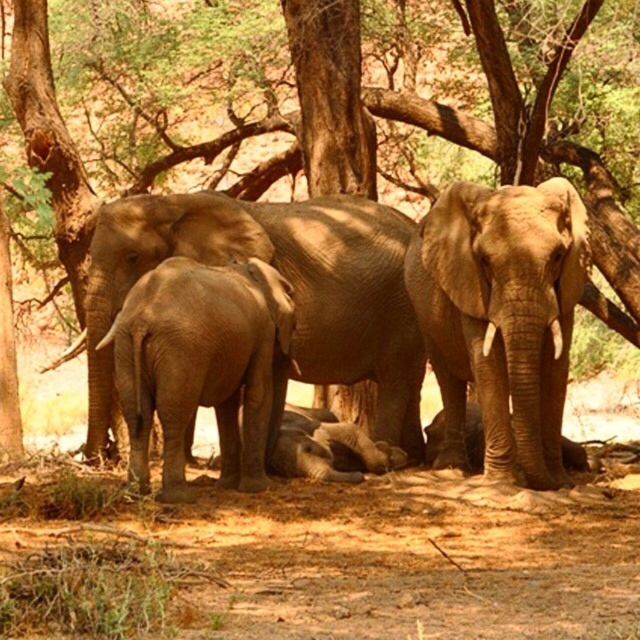
Where is `matte brown elephant at center`? The width and height of the screenshot is (640, 640). matte brown elephant at center is located at coordinates (288, 278).

Who is lower down, matte brown elephant at center or brown textured tree at center?

matte brown elephant at center is below.

Is point (154, 237) less distant than point (42, 124)?

That is True.

Image resolution: width=640 pixels, height=640 pixels. In order to click on matte brown elephant at center in this screenshot , I will do `click(288, 278)`.

Does smooth gray elephant at center come behind brown textured tree at center?

No, it is not.

Is point (240, 291) positioned behind point (81, 269)?

No, (240, 291) is in front of (81, 269).

Between point (244, 333) and point (419, 112), which one is positioned in front?

Point (244, 333) is in front.

I want to click on smooth gray elephant at center, so click(198, 364).

Does brown sandy dirt at center lie behind brown textured tree at center?

No, it is not.

Is brown sandy dirt at center to the right of brown textured tree at center from the viewer's perspective?

In fact, brown sandy dirt at center is to the left of brown textured tree at center.

Between point (376, 497) and point (307, 70), which one is positioned in front?

Point (376, 497) is more forward.

At what (x,y) coordinates should I click in order to perform the action: click on brown sandy dirt at center. Please return your answer as a coordinate pair (x, y). The height and width of the screenshot is (640, 640). Looking at the image, I should click on (404, 560).